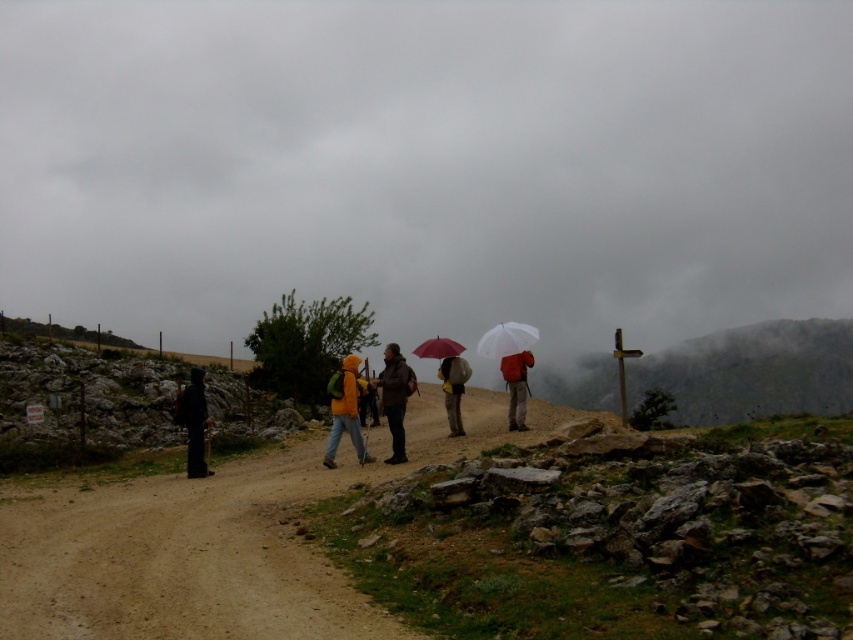
You are a hiker planning to walk along the dirt path. You notice the cloudy gray sky at upper center and the matte red umbrella at center. Which object in the scene takes up more space in the image?

The cloudy gray sky at upper center takes up more space in the image because it is larger in size than the matte red umbrella at center.

You are planning to take a photo of the matte red backpack at center while standing on the dirt path. Considering the cloudy gray sky at upper center, will the sky appear larger than the backpack in the photo?

The cloudy gray sky at upper center is much taller than the matte red backpack at center, so yes, the sky will appear larger than the backpack in the photo.